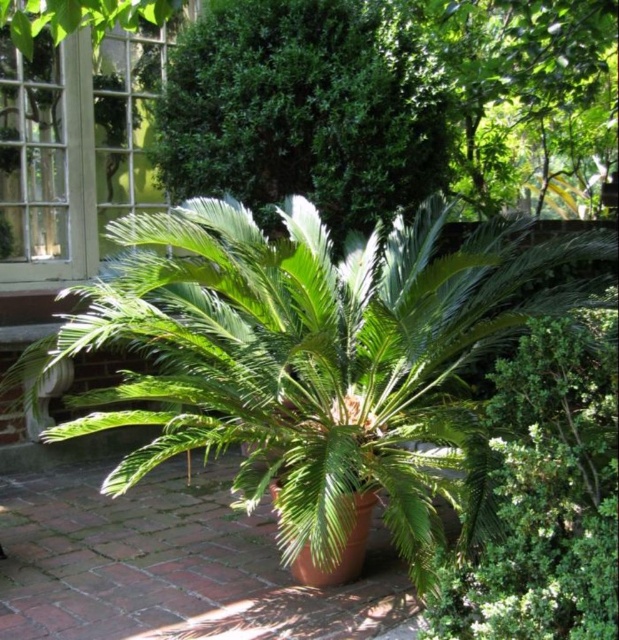
You are a gardener assessing the space between two plants in the image. The plants are the green leafy palm at center and the green leafy bush at center. Which plant has a larger width?

The green leafy palm at center might be wider than green leafy bush at center according to the description.

You are a gardener who needs to water both the green leafy palm at center and the green leafy bush at center. Your watering can has a maximum reach of 1 meter. Without moving the watering can, can you water both plants from your current position?

The distance between the green leafy palm at center and the green leafy bush at center is 1.07 meters. Since your watering can only reaches 1 meter, you cannot water both plants without moving the watering can.

You are a gardener assessing the plants in this outdoor scene. You need to determine which plant is taller between the green leafy palm at center and the green leafy bush at center. Based on the scene, which one is taller?

The green leafy palm at center is taller than the green leafy bush at center.